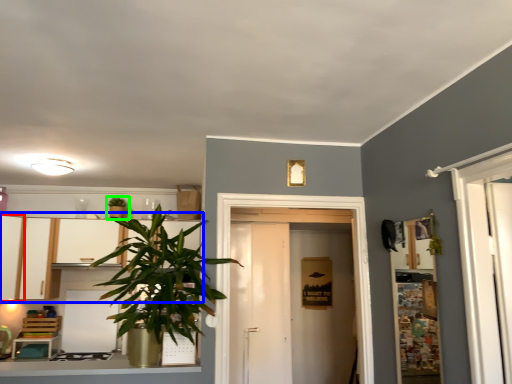
Question: Considering the real-world distances, which object is farthest from cabinetry (highlighted by a red box)? dresser (highlighted by a blue box) or houseplant (highlighted by a green box)?

Choices:
 (A) dresser
 (B) houseplant

Answer: (B)